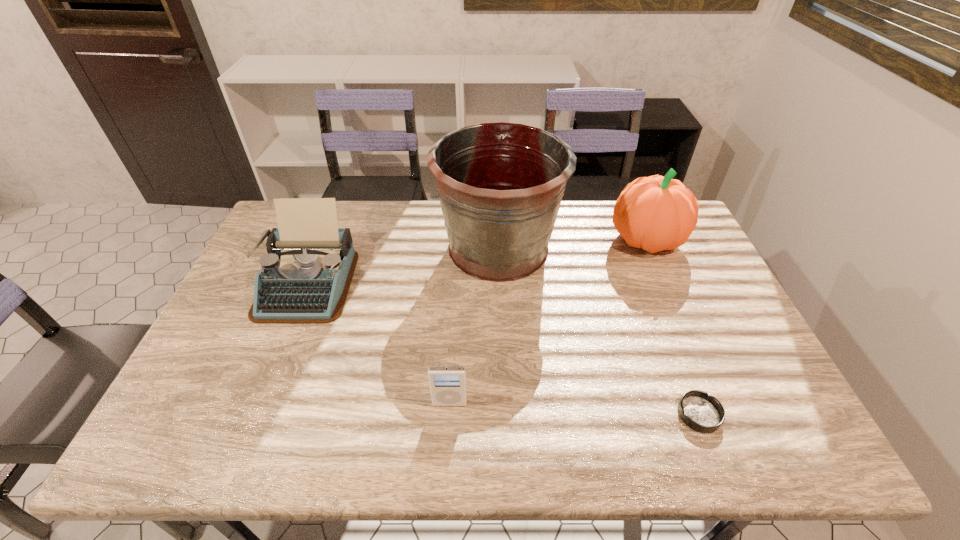
The image size is (960, 540). What are the coordinates of `the tallest object` in the screenshot? It's located at (500, 185).

The width and height of the screenshot is (960, 540). I want to click on the fourth shortest object, so click(655, 213).

At what (x,y) coordinates should I click in order to perform the action: click on typewriter. Please return your answer as a coordinate pair (x, y). This screenshot has width=960, height=540. Looking at the image, I should click on (304, 279).

Identify the location of the leftmost object. The height and width of the screenshot is (540, 960). (304, 279).

In order to click on iPod in this screenshot , I will do `click(447, 384)`.

Find the location of a particular element. the shortest object is located at coordinates (703, 413).

This screenshot has width=960, height=540. In order to click on free space located on the right of the bucket in this screenshot , I will do `click(677, 247)`.

I want to click on free spot located 0.130m on the left of the pumpkin, so click(569, 239).

Find the location of a particular element. free space located on the typing side of the third tallest object is located at coordinates (260, 398).

You are a GUI agent. You are given a task and a screenshot of the screen. Output one action in this format:
    pyautogui.click(x=<x>, y=<y>)
    Task: Click on the vacant space positioned on the front-facing side of the second shortest object
    This screenshot has width=960, height=540.
    Given the screenshot: What is the action you would take?
    click(448, 427)